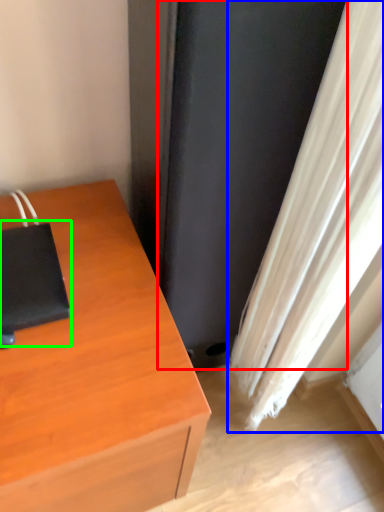
Question: Estimate the real-world distances between objects in this image. Which object is closer to screen door (highlighted by a red box), curtain (highlighted by a blue box) or notebook (highlighted by a green box)?

Choices:
 (A) curtain
 (B) notebook

Answer: (A)